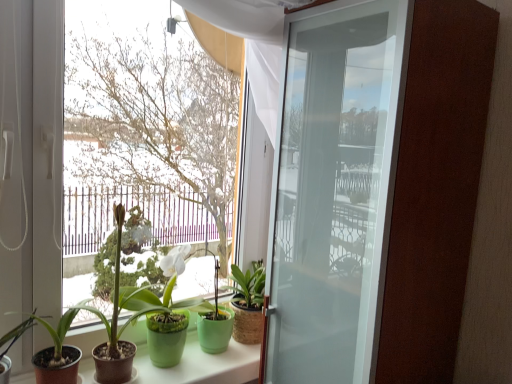
Image resolution: width=512 pixels, height=384 pixels. In order to click on free spot above green matte plant pots at lower center (from a real-world perspective) in this screenshot , I will do `click(200, 362)`.